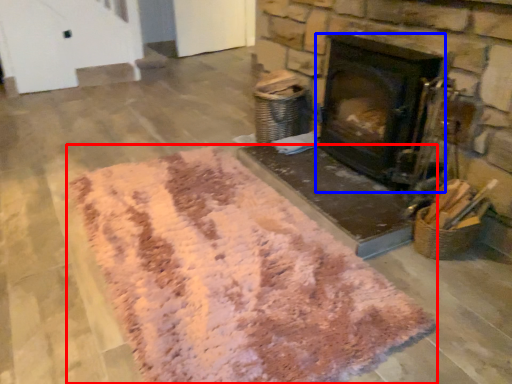
Question: Which of the following is the closest to the observer, mat (highlighted by a red box) or wood burning stove (highlighted by a blue box)?

Choices:
 (A) mat
 (B) wood burning stove

Answer: (A)